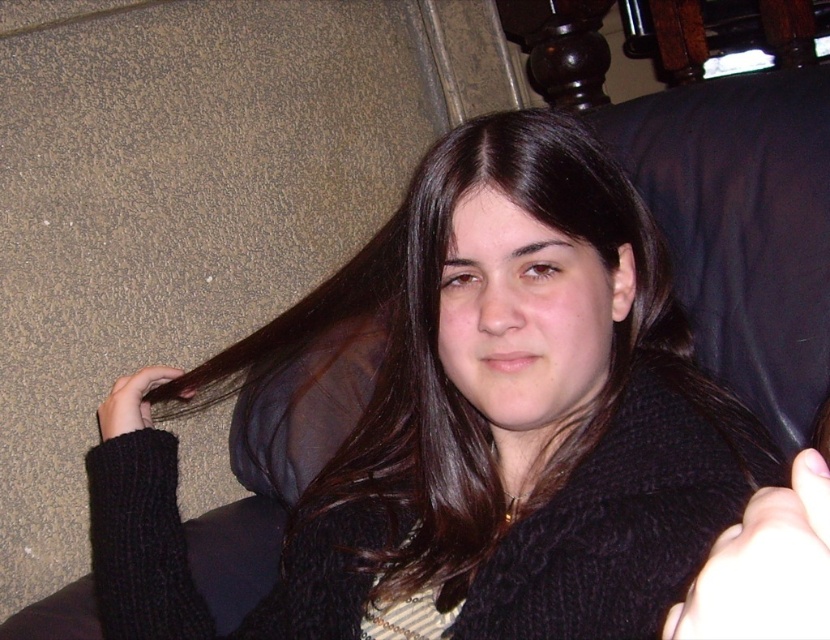
Question: Which point appears farthest from the camera in this image?

Choices:
 (A) (750, 634)
 (B) (487, 413)

Answer: (B)

Question: Which point is closer to the camera?

Choices:
 (A) (779, 504)
 (B) (99, 420)
 (C) (171, 628)

Answer: (A)

Question: Which point is closer to the camera taking this photo?

Choices:
 (A) (809, 602)
 (B) (106, 422)
 (C) (583, 470)

Answer: (A)

Question: Is dark brown hair at center in front of black knitted hand at upper left?

Choices:
 (A) no
 (B) yes

Answer: (B)

Question: Is dark brown hair at center above black knitted hand at upper left?

Choices:
 (A) yes
 (B) no

Answer: (A)

Question: Does dark brown hair at center have a larger size compared to black knitted hand at upper left?

Choices:
 (A) no
 (B) yes

Answer: (B)